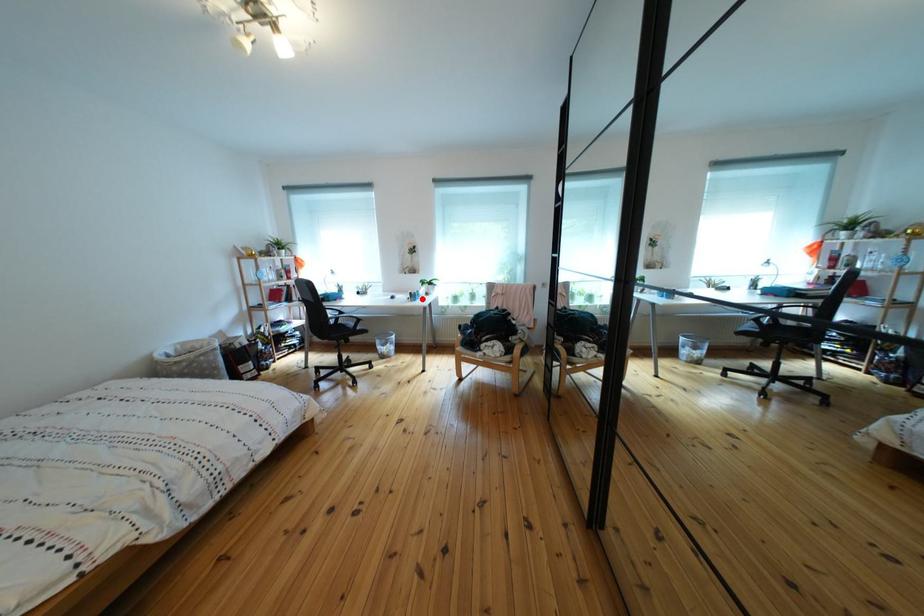
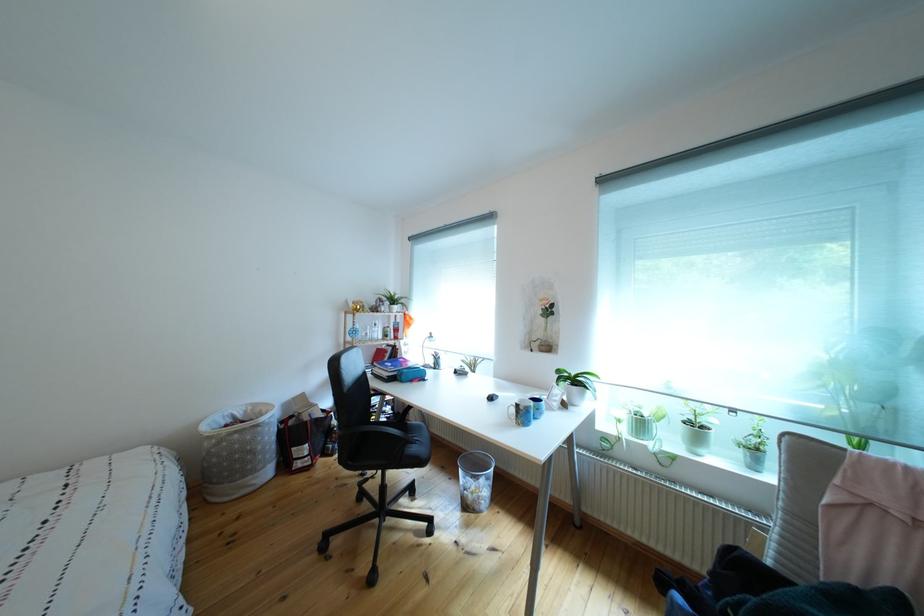
Find the pixel in the second image that matches the highlighted location in the first image.

(529, 411)